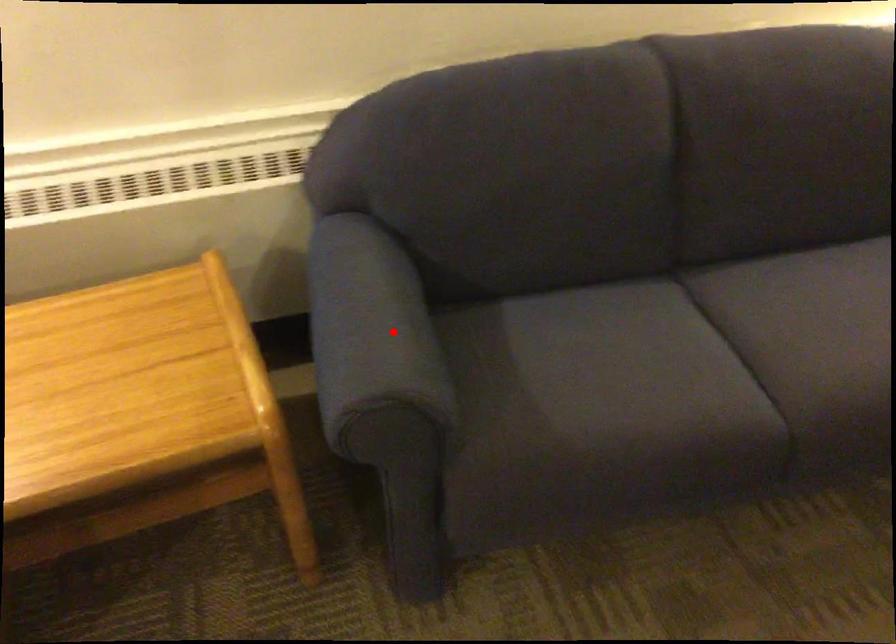
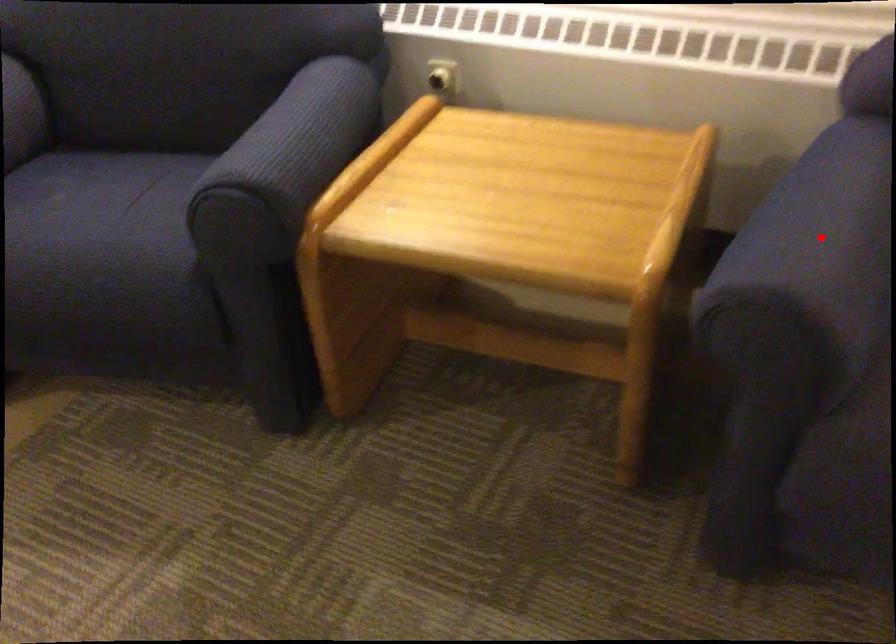
I am providing you with two images of the same scene from different viewpoints. A red point is marked on the first image and another point is marked on the second image. Does the point marked in image1 correspond to the same location as the one in image2?

Yes